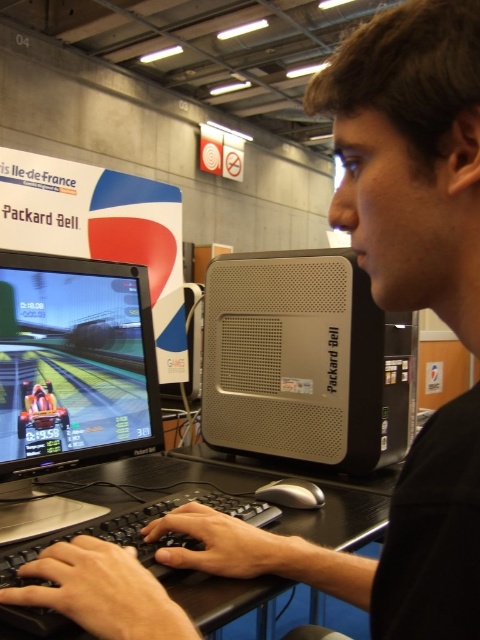
Question: Which object is farther from the camera taking this photo?

Choices:
 (A) black glossy monitor at left
 (B) silver metallic computer at center

Answer: (B)

Question: Among these points, which one is nearest to the camera?

Choices:
 (A) (36, 456)
 (B) (171, 474)
 (C) (303, 372)

Answer: (A)

Question: Estimate the real-world distances between objects in this image. Which object is closer to the silver metallic computer at center?

Choices:
 (A) black plastic keyboard at lower center
 (B) black glossy monitor at left

Answer: (A)

Question: Can you confirm if silver metallic computer at center is smaller than black glossy monitor at left?

Choices:
 (A) yes
 (B) no

Answer: (B)

Question: Is black glossy monitor at left wider than black plastic keyboard at lower center?

Choices:
 (A) no
 (B) yes

Answer: (A)

Question: Is silver metallic computer at center below black glossy monitor at left?

Choices:
 (A) no
 (B) yes

Answer: (A)